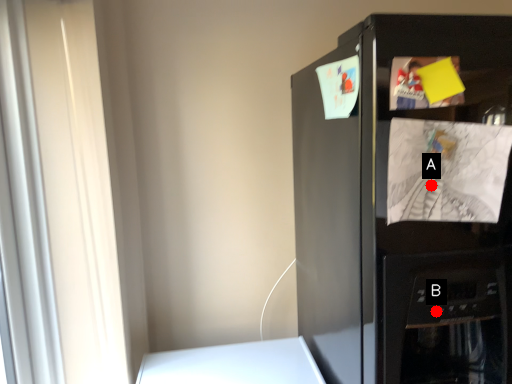
Question: Two points are circled on the image, labeled by A and B beside each circle. Which point is further to the camera?

Choices:
 (A) A is further
 (B) B is further

Answer: (B)